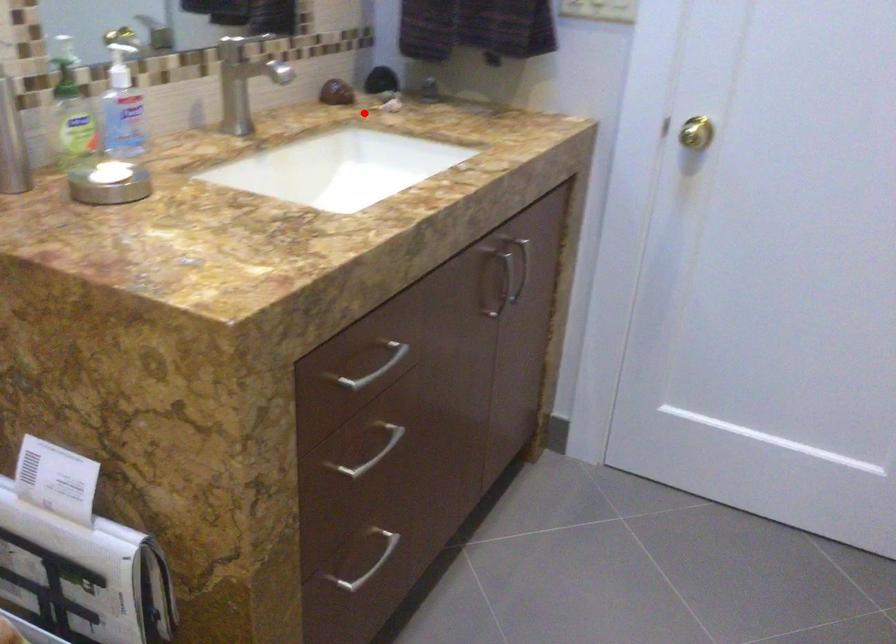
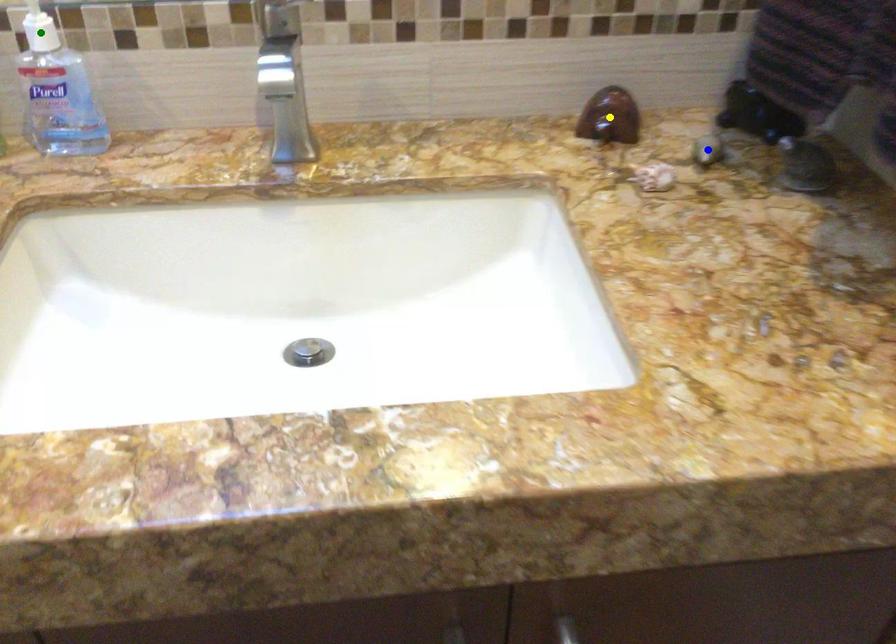
Question: I am providing you with two images of the same scene from different viewpoints. A red point is marked on the first image. You are given multiple points on the second image. Which spot in image 2 lines up with the point in image 1?

Choices:
 (A) green point
 (B) yellow point
 (C) blue point

Answer: (B)